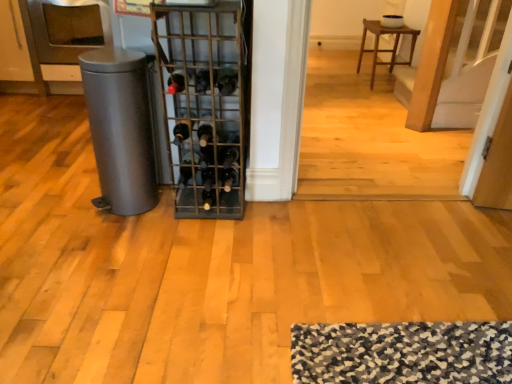
At what (x,y) coordinates should I click in order to perform the action: click on blank space to the left of brown wooden stool at upper center. Please return your answer as a coordinate pair (x, y). Image resolution: width=512 pixels, height=384 pixels. Looking at the image, I should click on (336, 82).